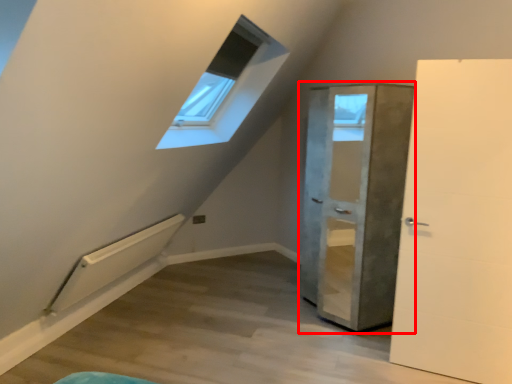
Question: From the image's perspective, where is door (annotated by the red box) located in relation to door in the image?

Choices:
 (A) above
 (B) below

Answer: (A)